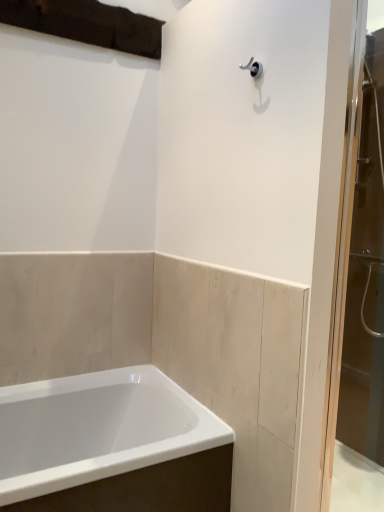
Question: Is white glossy bathtub at lower left aimed at transparent glass screen door at right?

Choices:
 (A) yes
 (B) no

Answer: (B)

Question: Considering the relative sizes of white glossy bathtub at lower left and transparent glass screen door at right in the image provided, is white glossy bathtub at lower left smaller than transparent glass screen door at right?

Choices:
 (A) yes
 (B) no

Answer: (B)

Question: Is white glossy bathtub at lower left positioned beyond the bounds of transparent glass screen door at right?

Choices:
 (A) no
 (B) yes

Answer: (B)

Question: Is there a large distance between white glossy bathtub at lower left and transparent glass screen door at right?

Choices:
 (A) yes
 (B) no

Answer: (B)

Question: Is white glossy bathtub at lower left looking in the opposite direction of transparent glass screen door at right?

Choices:
 (A) yes
 (B) no

Answer: (B)

Question: Can you confirm if white glossy bathtub at lower left is positioned to the right of transparent glass screen door at right?

Choices:
 (A) no
 (B) yes

Answer: (A)

Question: Is transparent glass screen door at right not inside white glossy bathtub at lower left?

Choices:
 (A) no
 (B) yes

Answer: (B)

Question: Is the position of transparent glass screen door at right less distant than that of white glossy bathtub at lower left?

Choices:
 (A) yes
 (B) no

Answer: (B)

Question: Is transparent glass screen door at right far away from white glossy bathtub at lower left?

Choices:
 (A) yes
 (B) no

Answer: (B)

Question: Considering the relative sizes of transparent glass screen door at right and white glossy bathtub at lower left in the image provided, is transparent glass screen door at right wider than white glossy bathtub at lower left?

Choices:
 (A) yes
 (B) no

Answer: (B)

Question: From a real-world perspective, is transparent glass screen door at right located beneath white glossy bathtub at lower left?

Choices:
 (A) no
 (B) yes

Answer: (A)

Question: Is transparent glass screen door at right next to white glossy bathtub at lower left and touching it?

Choices:
 (A) no
 (B) yes

Answer: (A)

Question: From a real-world perspective, is transparent glass screen door at right above or below white glossy bathtub at lower left?

Choices:
 (A) below
 (B) above

Answer: (B)